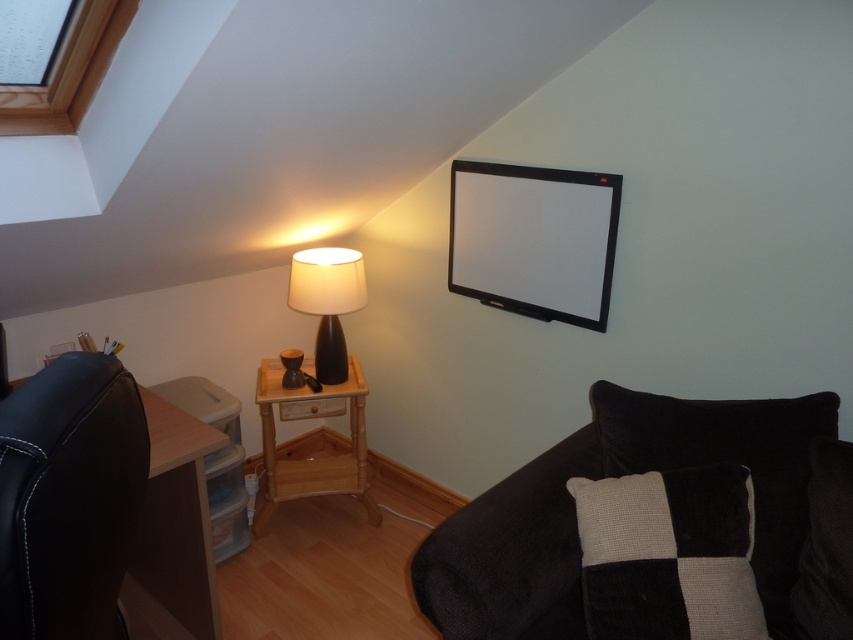
You are planning to hang a picture frame that is 1 meter wide on the wall where the transparent glass window at upper left and the matte black lamp at center are located. Based on their widths, can you determine if the picture frame will fit between them?

The transparent glass window at upper left might be wider than matte black lamp at center, so the picture frame that is 1 meter wide may or may not fit between them depending on the exact width of the window. You need to measure the space between them first.

You are sitting in the black leather chair and want to place a book on the black textured pillow at lower right and the transparent glass window at upper left. Which surface can you reach without moving from the chair?

The black textured pillow at lower right is taller than the transparent glass window at upper left, so you can reach the transparent glass window at upper left but not the taller pillow.

You are sitting in the black leather chair and want to look out the transparent glass window at upper left. Is the black textured pillow at lower right blocking your view of the window?

The black textured pillow at lower right is in front of the transparent glass window at upper left, so it would block your view of the window when sitting in the chair.